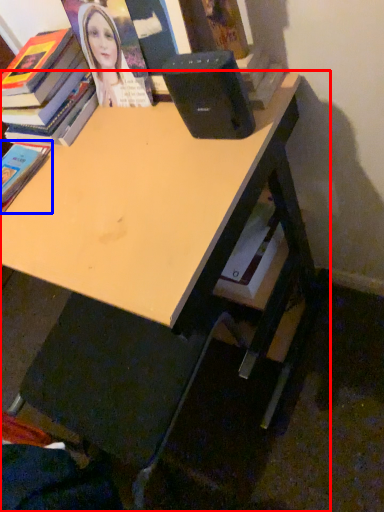
Question: Among these objects, which one is farthest to the camera, desk (highlighted by a red box) or book (highlighted by a blue box)?

Choices:
 (A) desk
 (B) book

Answer: (B)